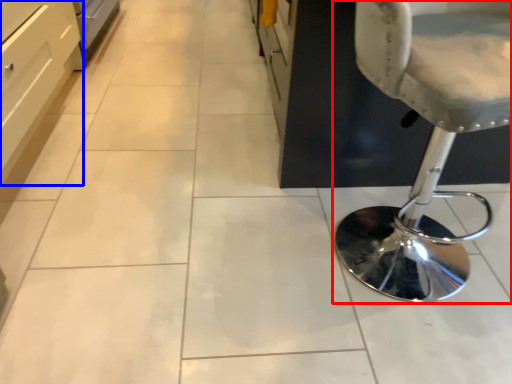
Question: Which of the following is the closest to the observer, chair (highlighted by a red box) or drawer (highlighted by a blue box)?

Choices:
 (A) chair
 (B) drawer

Answer: (A)